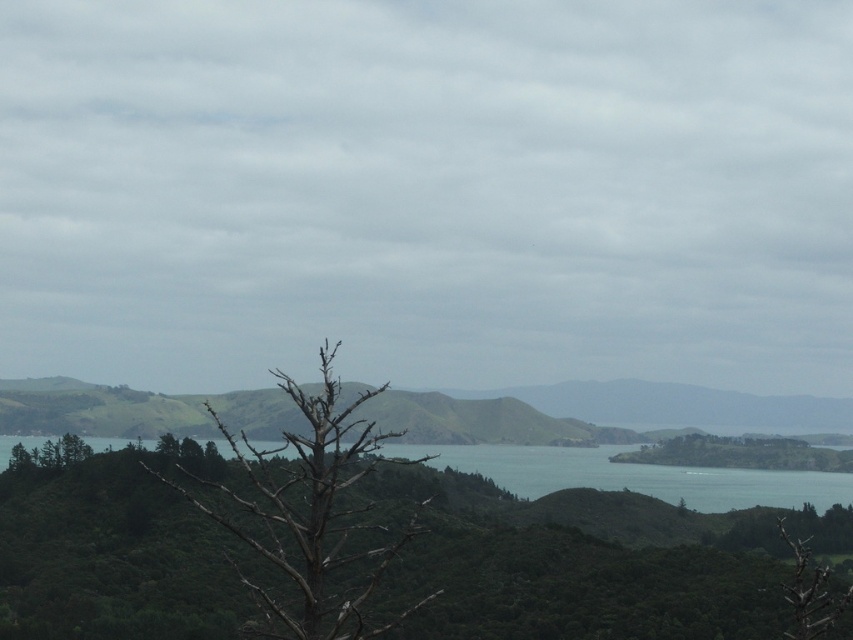
You are an artist planning to paint this landscape. You want to ensure the bare wood tree at center and green water at center are proportionally accurate. Which object should you make wider in your painting?

The green water at center should be made wider in the painting since the bare wood tree at center has a lesser width compared to the green water at center according to the scene description.

You are a bird looking for a resting spot. You see the bare wood tree at center. Based on its position, can you determine if it is in the foreground, midground, or background of the image?

The bare wood tree at center is located at point (312, 509), which places it in the foreground of the image.